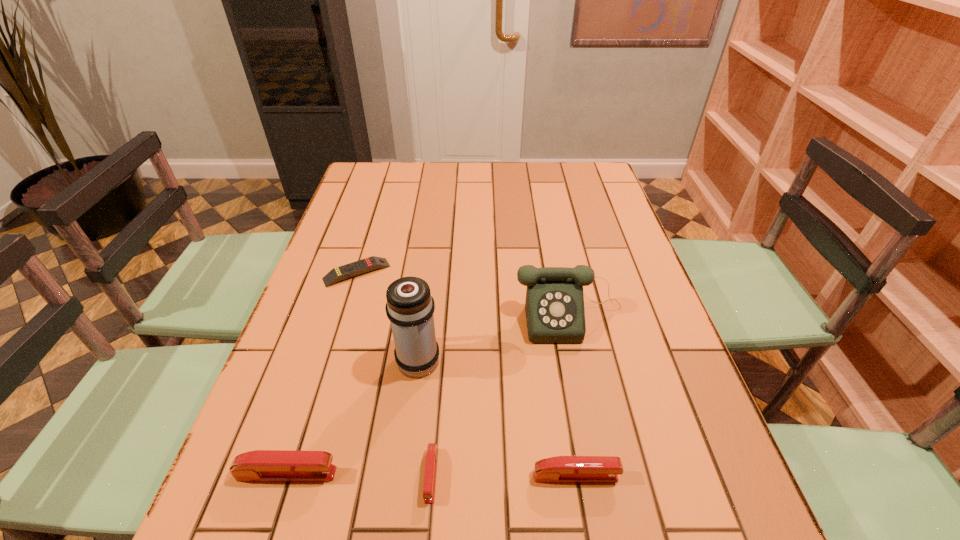
Identify the location of the leftmost stapler. The height and width of the screenshot is (540, 960). (261, 465).

The image size is (960, 540). Find the location of `the shortest stapler`. the shortest stapler is located at coordinates (431, 456).

Image resolution: width=960 pixels, height=540 pixels. Identify the location of the second stapler from right to left. (431, 456).

I want to click on the second tallest stapler, so click(x=561, y=469).

I want to click on the fourth tallest object, so click(x=561, y=469).

Where is `thermos bottle`? This screenshot has height=540, width=960. thermos bottle is located at coordinates (409, 307).

Find the location of a particular element. The image size is (960, 540). the fifth shortest object is located at coordinates (554, 306).

You are a GUI agent. You are given a task and a screenshot of the screen. Output one action in this format:
    pyautogui.click(x=<x>, y=<y>)
    Task: Click on the farthest object
    The height and width of the screenshot is (540, 960).
    Given the screenshot: What is the action you would take?
    pyautogui.click(x=371, y=263)

In order to click on remote control in this screenshot , I will do `click(371, 263)`.

Where is `blank space located 0.120m on the front-facing side of the leftmost stapler`? The height and width of the screenshot is (540, 960). blank space located 0.120m on the front-facing side of the leftmost stapler is located at coordinates (402, 474).